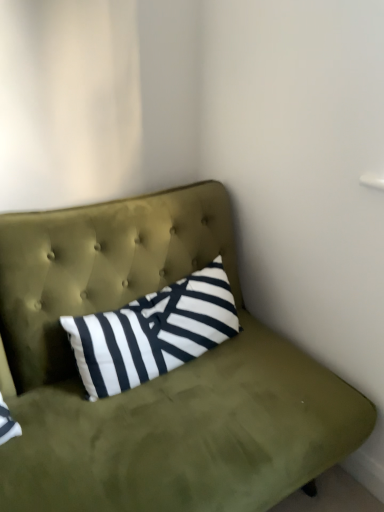
Question: Do you think olive green fabric studio couch at upper center is within black and white striped pillow at center, or outside of it?

Choices:
 (A) outside
 (B) inside

Answer: (A)

Question: From the image's perspective, relative to black and white striped pillow at center, is olive green fabric studio couch at upper center above or below?

Choices:
 (A) above
 (B) below

Answer: (B)

Question: Is olive green fabric studio couch at upper center taller or shorter than black and white striped pillow at center?

Choices:
 (A) short
 (B) tall

Answer: (B)

Question: Is black and white striped pillow at center bigger or smaller than olive green fabric studio couch at upper center?

Choices:
 (A) small
 (B) big

Answer: (A)

Question: Considering their positions, is black and white striped pillow at center located in front of or behind olive green fabric studio couch at upper center?

Choices:
 (A) behind
 (B) front

Answer: (A)

Question: Is black and white striped pillow at center taller or shorter than olive green fabric studio couch at upper center?

Choices:
 (A) short
 (B) tall

Answer: (A)

Question: Is point (200, 290) closer or farther from the camera than point (152, 262)?

Choices:
 (A) closer
 (B) farther

Answer: (A)